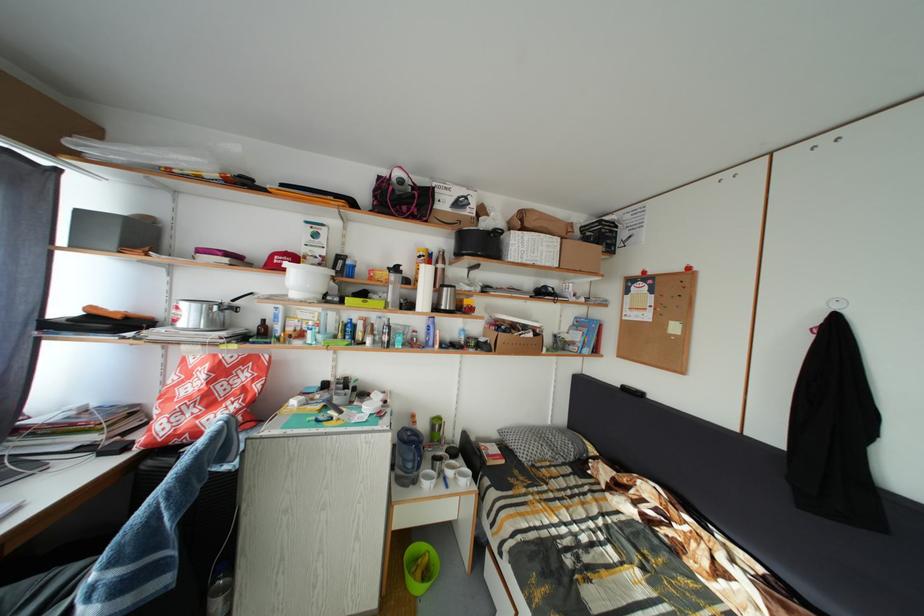
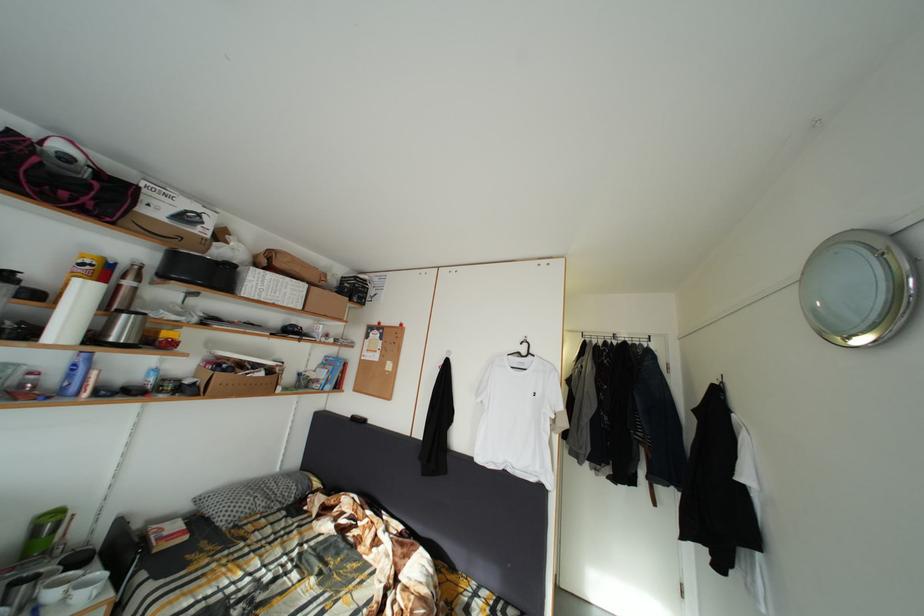
Find the pixel in the second image that matches (x=435, y=349) in the first image.

(73, 395)